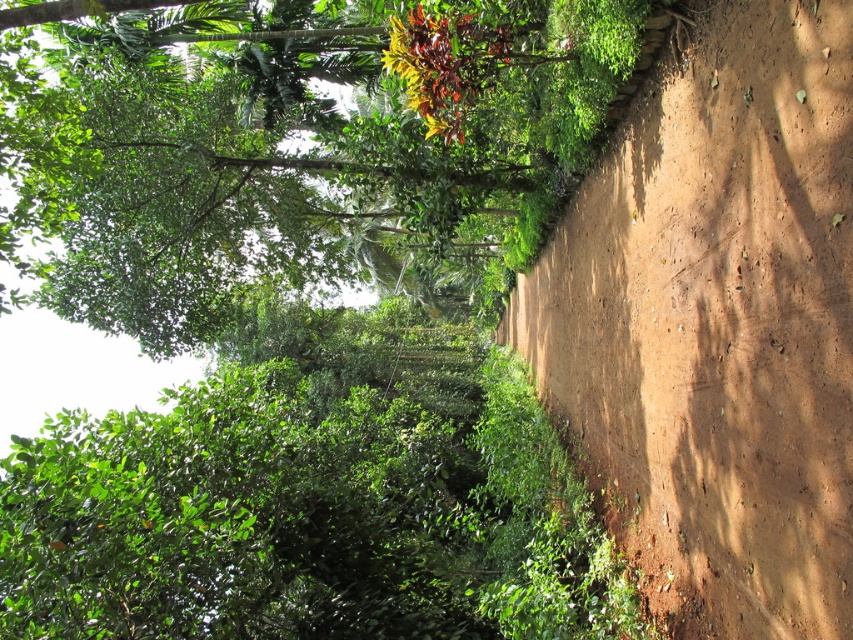
You are standing at the starting point of the dirt path in the scene. There are two points marked on the path. The first point is at coordinate point (201, 428) and the second point is at coordinate point (21, 100). If you walk towards the direction the path is heading, which point will you reach first?

Point (21, 100) will be reached first because point (201, 428) is located behind it along the path.

You are a hiker walking along the dirt path and want to take a photo of both the green leafy bush at center and the green leafy tree at center. Since you can only focus on one object at a time, which one should you focus on to ensure the other is still in the background?

You should focus on the green leafy bush at center because it is in front of the green leafy tree at center, so the tree will naturally appear in the background when the bush is in focus.